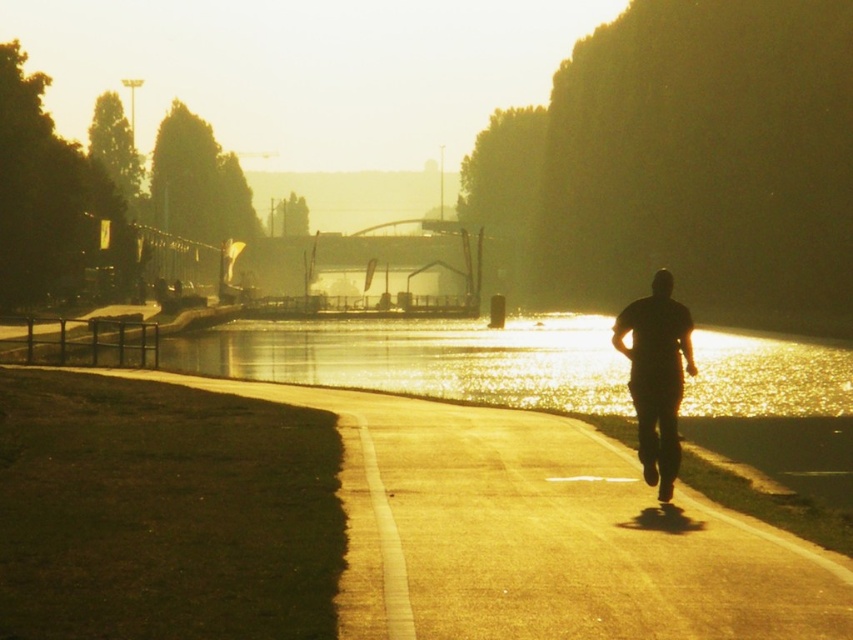
Question: Is smooth asphalt path at center positioned behind black matte man at center?

Choices:
 (A) yes
 (B) no

Answer: (B)

Question: Can you confirm if smooth asphalt path at center is positioned to the left of black matte man at center?

Choices:
 (A) no
 (B) yes

Answer: (B)

Question: Which point appears closest to the camera in this image?

Choices:
 (A) (587, 593)
 (B) (643, 321)

Answer: (A)

Question: Which point is farther to the camera?

Choices:
 (A) pyautogui.click(x=641, y=416)
 (B) pyautogui.click(x=419, y=416)

Answer: (B)

Question: Which point is closer to the camera taking this photo?

Choices:
 (A) (668, 500)
 (B) (820, 602)

Answer: (B)

Question: Can you confirm if smooth asphalt path at center is positioned above black matte man at center?

Choices:
 (A) no
 (B) yes

Answer: (A)